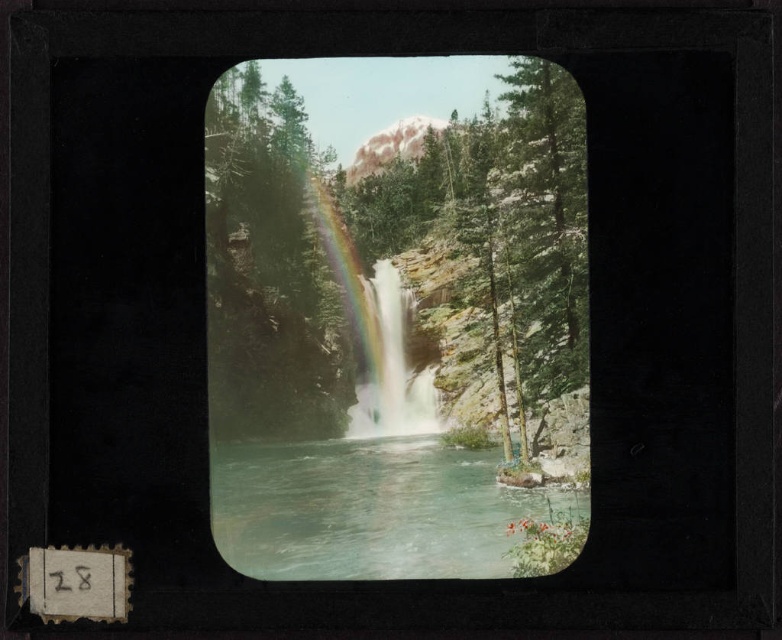
Question: Based on their relative distances, which object is nearer to the green textured tree at center?

Choices:
 (A) rainbow-colored water at center
 (B) clear water at center

Answer: (A)

Question: Which of the following is the farthest from the observer?

Choices:
 (A) (513, 452)
 (B) (292, 547)
 (C) (364, 275)

Answer: (C)

Question: Which of the following is the farthest from the observer?

Choices:
 (A) (361, 440)
 (B) (404, 339)

Answer: (B)

Question: Where is green textured tree at center located in relation to clear water at center in the image?

Choices:
 (A) below
 (B) above

Answer: (B)

Question: From the image, what is the correct spatial relationship of green textured tree at center in relation to rainbow-colored water at center?

Choices:
 (A) below
 (B) above

Answer: (B)

Question: Does green textured tree at center have a smaller size compared to rainbow-colored water at center?

Choices:
 (A) yes
 (B) no

Answer: (B)